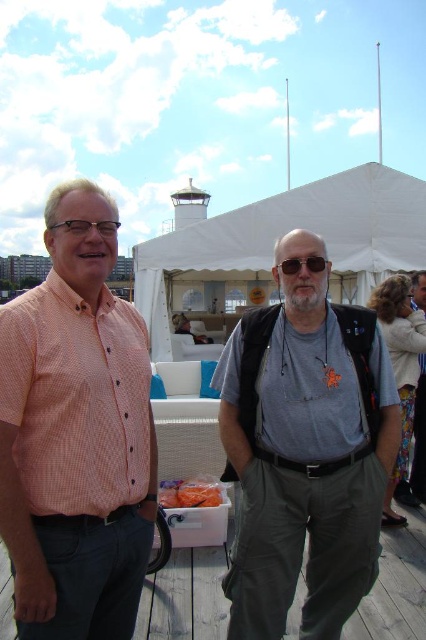
You are at a social event and want to take a photo of the blonde hair woman at right. The camera you are using has a zoom lens that can focus on objects within a 0.5 unit radius. Given that the point you need to focus on is at coordinate point (400, 368), will the camera be able to capture the blonde hair woman at right clearly?

The point (400, 368) corresponds to the blonde hair woman at right, so yes, the camera can focus on her clearly within the 0.5 unit radius.

You are standing at the position of the gray fabric backpack at center. Looking towards the tent, is the tent to your left or right side?

The tent is to your back because the gray fabric backpack at center is located at point (419, 440), which places it facing away from the tent. Therefore, the tent would be behind you.

You are taking a photo of two people standing on a wooden deck at an event. You notice two points in the image with coordinates point (420, 492) and point (193, 483). Which point is closer to the camera?

Point (420, 492) is closer to the camera than point (193, 483) because it is further to the camera than the other point.